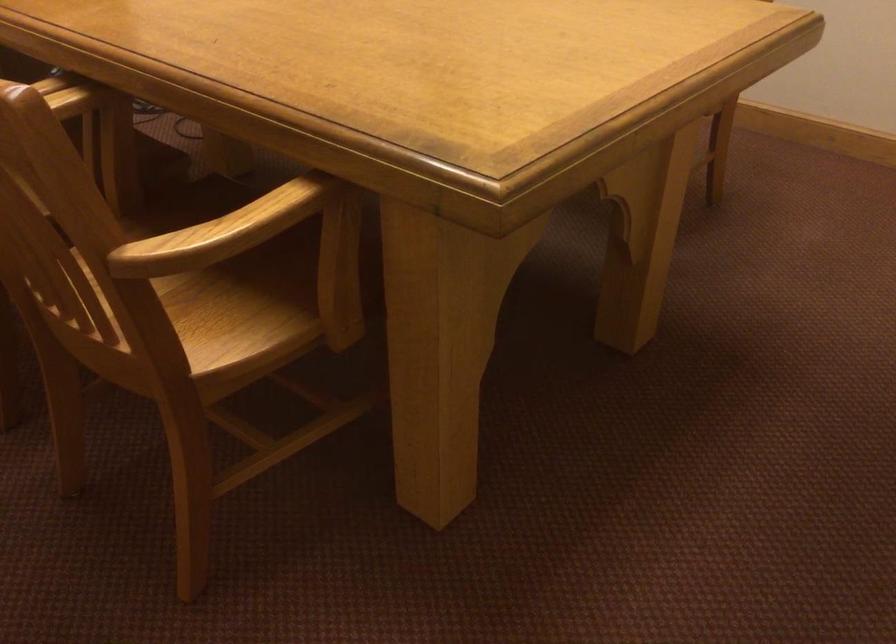
Locate an element on the screen. wooden chair armrest is located at coordinates (221, 232).